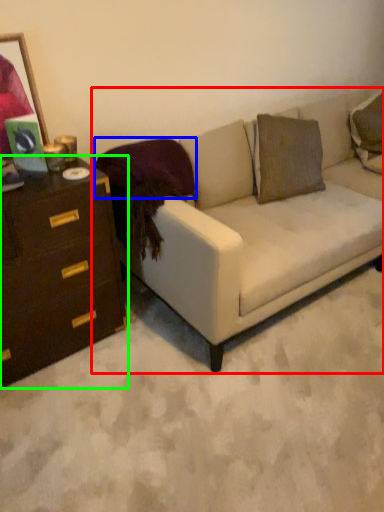
Question: Considering the real-world distances, which object is farthest from studio couch (highlighted by a red box)? pillow (highlighted by a blue box) or chest of drawers (highlighted by a green box)?

Choices:
 (A) pillow
 (B) chest of drawers

Answer: (B)